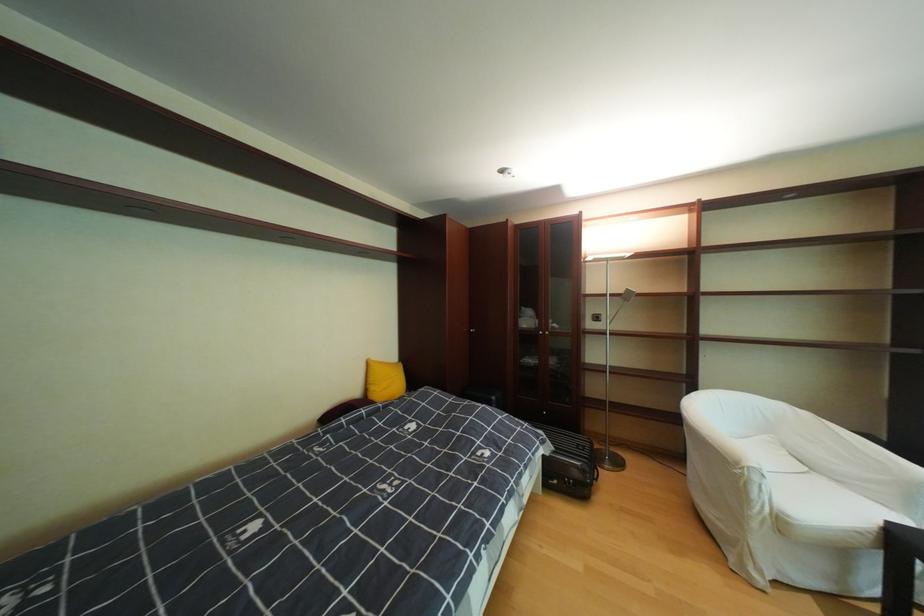
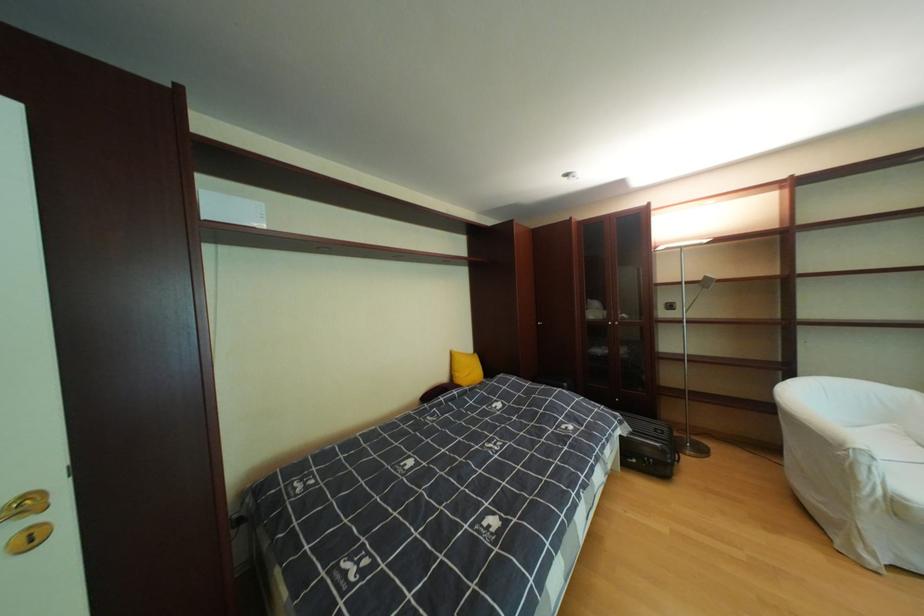
Question: The images are taken continuously from a first-person perspective. In which direction is your viewpoint rotating?

Choices:
 (A) Left
 (B) Right
 (C) Up
 (D) Down

Answer: (A)